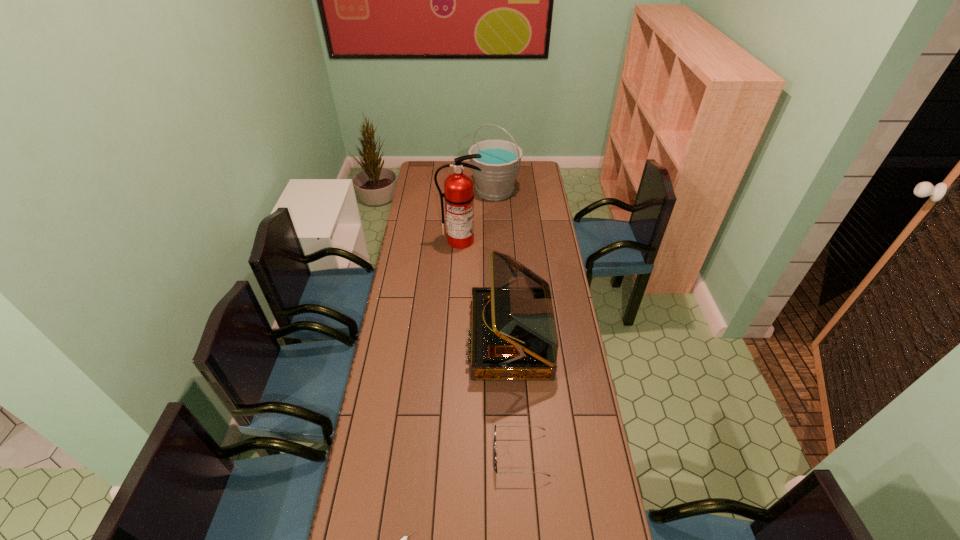
Image resolution: width=960 pixels, height=540 pixels. In order to click on free space at the left edge in this screenshot , I will do `click(414, 192)`.

The height and width of the screenshot is (540, 960). I want to click on vacant space at the right edge of the desktop, so click(x=569, y=333).

The height and width of the screenshot is (540, 960). What are the coordinates of `free space that is in between the second shortest object and the third farthest object` in the screenshot? It's located at (516, 396).

Locate an element on the screen. This screenshot has height=540, width=960. vacant space that's between the fourth nearest object and the farthest object is located at coordinates (477, 215).

Locate which object ranks third in proximity to the record player. Please provide its 2D coordinates. Your answer should be formatted as a tuple, i.e. [(x, y)], where the tuple contains the x and y coordinates of a point satisfying the conditions above.

[(404, 539)]

Find the location of a particular element. The image size is (960, 540). object that can be found as the closest to the third tallest object is located at coordinates (495, 453).